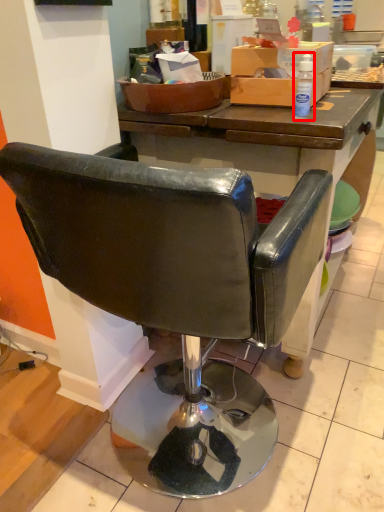
Question: Considering the relative positions of bottle (annotated by the red box) and chair in the image provided, where is bottle (annotated by the red box) located with respect to the staircase?

Choices:
 (A) left
 (B) right

Answer: (B)